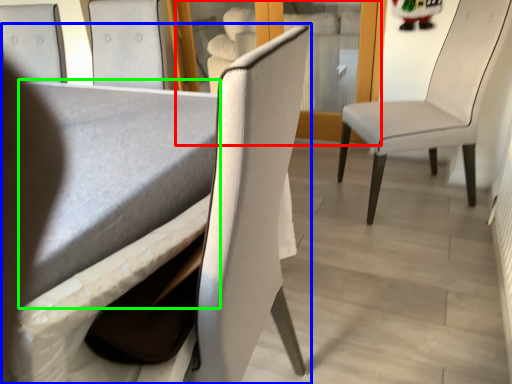
Question: Considering the real-world distances, which object is farthest from glass door (highlighted by a red box)? chair (highlighted by a blue box) or table (highlighted by a green box)?

Choices:
 (A) chair
 (B) table

Answer: (A)